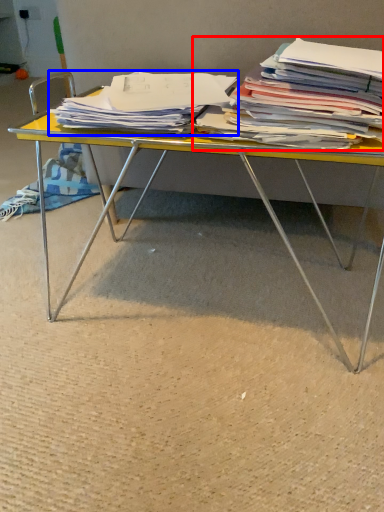
Question: Which object is closer to the camera taking this photo, magazine (highlighted by a red box) or magazine (highlighted by a blue box)?

Choices:
 (A) magazine
 (B) magazine

Answer: (A)